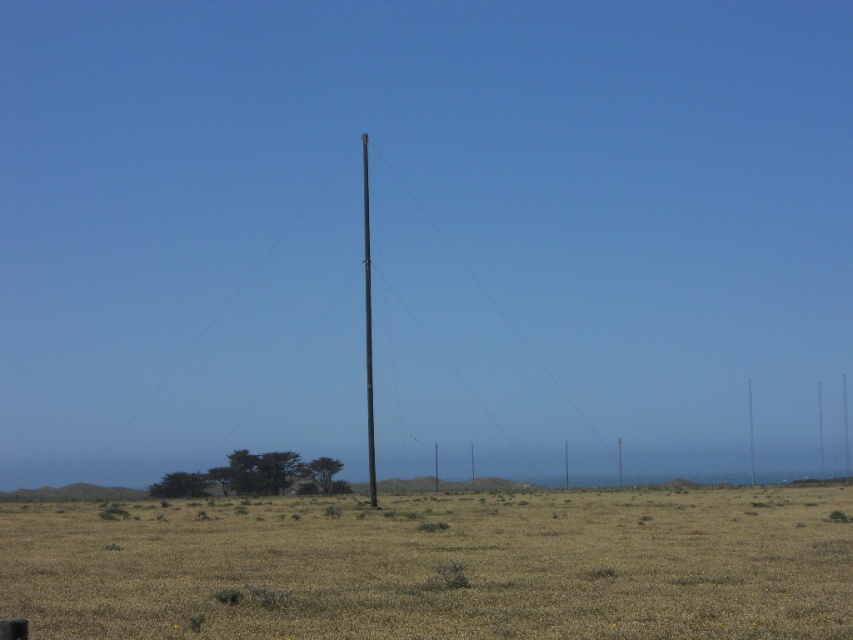
Looking at this image, you are a drone operator planning to fly a drone over the brown grassland at center and the black metallic pole at center. Based on their positions, which object would the drone encounter first during takeoff?

The brown grassland at center is in front of the black metallic pole at center, so the drone would encounter the brown grassland at center first during takeoff.

You are a hiker standing in the desert and see the black metallic pole at center and the black smooth telegraph pole at center. Which pole is higher up in the image?

The black metallic pole at center is located above the black smooth telegraph pole at center, so it is higher up in the image.

You are a hiker in the desert and you see the black metallic pole at center and the black smooth telegraph pole at center. Which pole is taller?

The black smooth telegraph pole at center is taller than the black metallic pole at center.